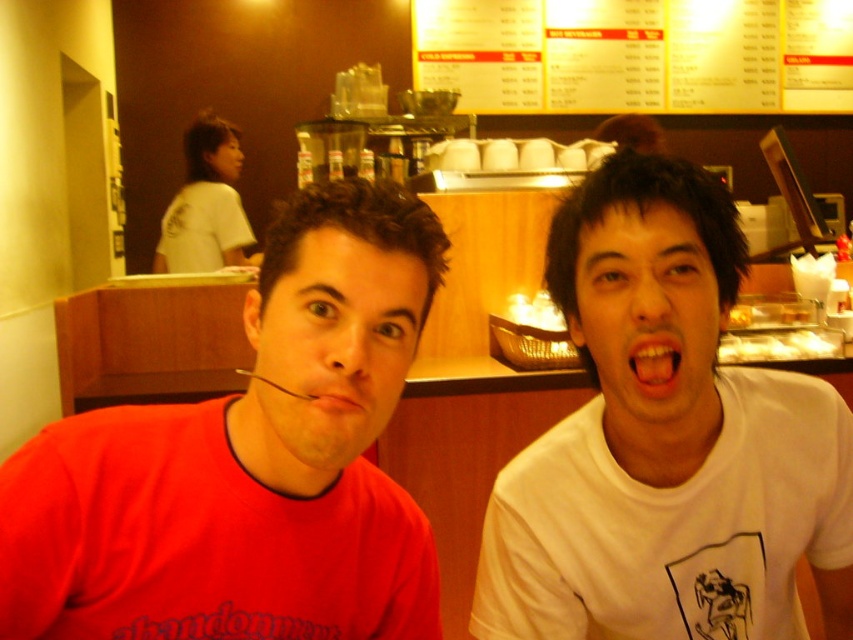
Question: Considering the real-world distances, which object is closest to the white paper at upper center?

Choices:
 (A) matte red shirt at center
 (B) white glossy teeth at center

Answer: (A)

Question: Is matte red shirt at center to the left of white matte shirt at right from the viewer's perspective?

Choices:
 (A) yes
 (B) no

Answer: (A)

Question: Is white matte shirt at right wider than pink matte lips at center?

Choices:
 (A) yes
 (B) no

Answer: (A)

Question: Which object appears farthest from the camera in this image?

Choices:
 (A) white paper at upper center
 (B) pink matte lips at center
 (C) white matte shirt at upper left

Answer: (A)

Question: Does white paper at upper center appear on the left side of white glossy teeth at center?

Choices:
 (A) no
 (B) yes

Answer: (A)

Question: Which object is farther from the camera taking this photo?

Choices:
 (A) white matte shirt at upper left
 (B) white paper at upper center
 (C) white glossy teeth at center

Answer: (B)